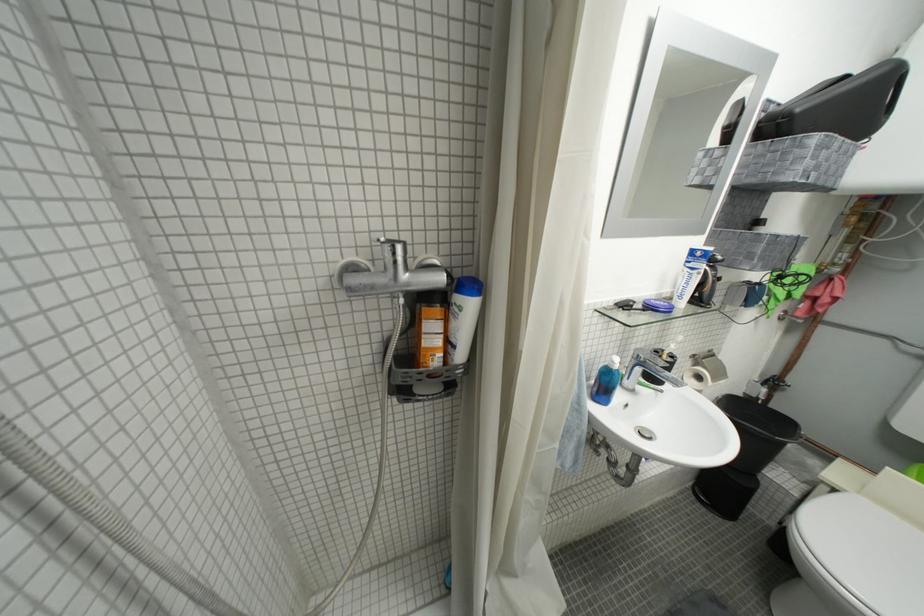
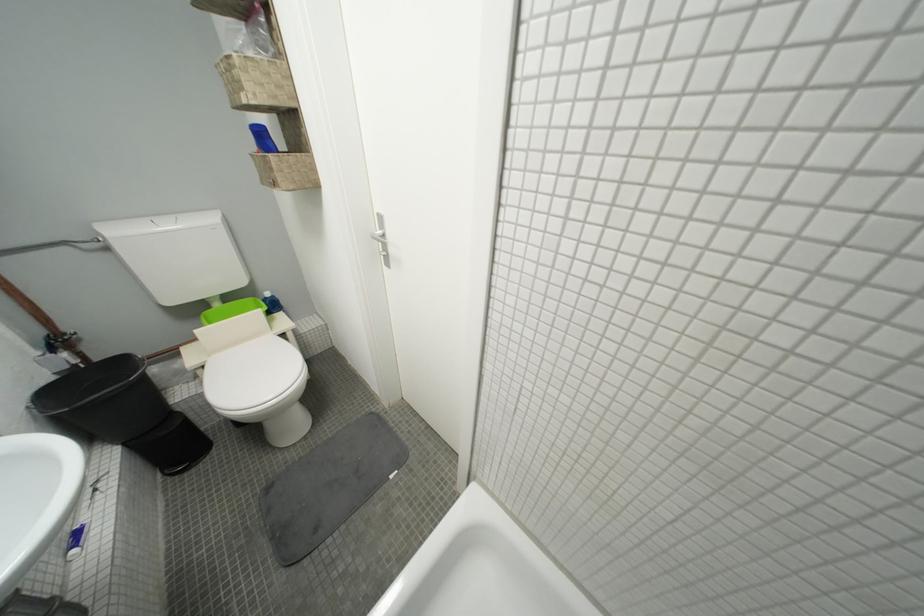
How did the camera likely rotate?

The rotation direction of the camera is right-down.